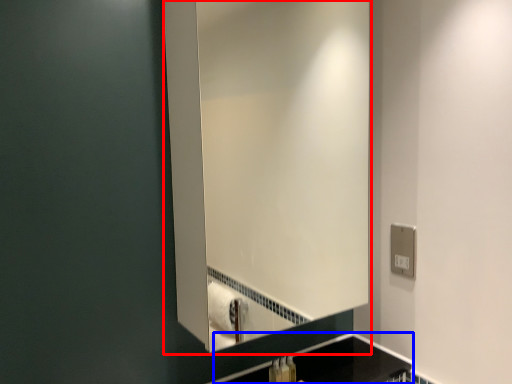
Question: Which object is further to the camera taking this photo, mirror (highlighted by a red box) or counter top (highlighted by a blue box)?

Choices:
 (A) mirror
 (B) counter top

Answer: (B)